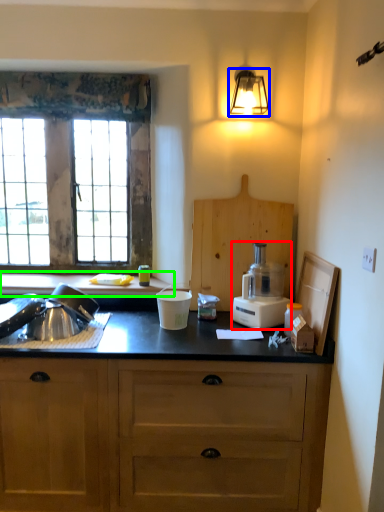
Question: Which object is positioned closest to kitchen appliance (highlighted by a red box)? Select from light fixture (highlighted by a blue box) and countertop (highlighted by a green box).

Choices:
 (A) light fixture
 (B) countertop

Answer: (B)